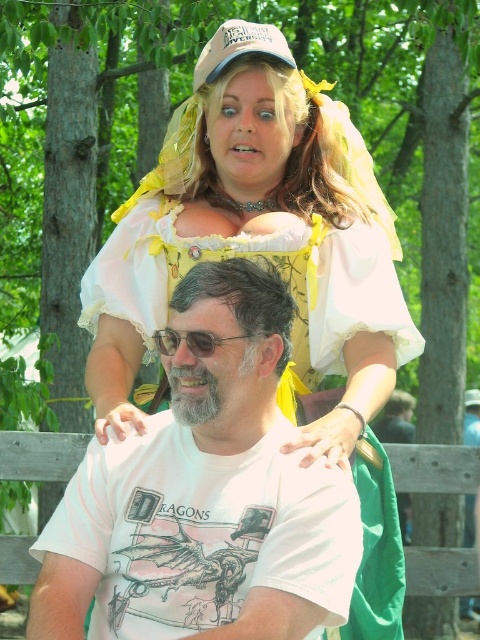
Question: Which of the following is the farthest from the observer?

Choices:
 (A) (386, 257)
 (B) (214, 346)
 (C) (103, 554)
 (D) (193, 76)

Answer: (D)

Question: Is white lace dress at upper center to the left of white t-shirt at center from the viewer's perspective?

Choices:
 (A) yes
 (B) no

Answer: (B)

Question: Which object is farther from the camera taking this photo?

Choices:
 (A) white mesh baseball cap at upper center
 (B) clear plastic goggles at center
 (C) white t-shirt at center
 (D) white lace dress at upper center

Answer: (A)

Question: Can you confirm if white lace dress at upper center is thinner than white mesh baseball cap at upper center?

Choices:
 (A) yes
 (B) no

Answer: (B)

Question: Estimate the real-world distances between objects in this image. Which object is closer to the white t-shirt at center?

Choices:
 (A) clear plastic goggles at center
 (B) white lace dress at upper center

Answer: (A)

Question: Does white mesh baseball cap at upper center appear on the right side of clear plastic goggles at center?

Choices:
 (A) no
 (B) yes

Answer: (B)